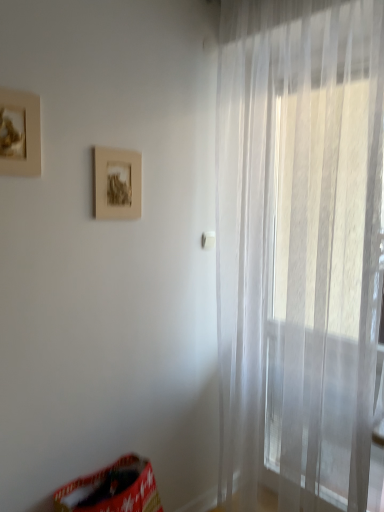
Question: Considering the relative positions of transparent fabric curtain at right and matte gold picture frame at upper left, the second picture frame when ordered from right to left, in the image provided, is transparent fabric curtain at right to the right of matte gold picture frame at upper left, the second picture frame when ordered from right to left, from the viewer's perspective?

Choices:
 (A) no
 (B) yes

Answer: (B)

Question: Does transparent fabric curtain at right come in front of matte gold picture frame at upper left, acting as the 1th picture frame starting from the left?

Choices:
 (A) yes
 (B) no

Answer: (A)

Question: Is transparent fabric curtain at right positioned far away from matte gold picture frame at upper left, which is the 2th picture frame from back to front?

Choices:
 (A) no
 (B) yes

Answer: (B)

Question: Is transparent fabric curtain at right bigger than matte gold picture frame at upper left, which is the 2th picture frame from back to front?

Choices:
 (A) yes
 (B) no

Answer: (A)

Question: Is transparent fabric curtain at right oriented towards matte gold picture frame at upper left, acting as the 1th picture frame starting from the left?

Choices:
 (A) no
 (B) yes

Answer: (B)

Question: From the image's perspective, is transparent fabric curtain at right above matte gold picture frame at upper left, which is the 2th picture frame from back to front?

Choices:
 (A) yes
 (B) no

Answer: (B)

Question: From the image's perspective, does matte brown picture frame at center, which is the first picture frame from back to front, appear lower than red fabric bean bag chair at lower left?

Choices:
 (A) yes
 (B) no

Answer: (B)

Question: Is matte brown picture frame at center, which is the first picture frame from back to front, directly adjacent to red fabric bean bag chair at lower left?

Choices:
 (A) yes
 (B) no

Answer: (B)

Question: Does matte brown picture frame at center, the 1th picture frame from the right, come in front of red fabric bean bag chair at lower left?

Choices:
 (A) no
 (B) yes

Answer: (A)

Question: Does matte brown picture frame at center, which is the second picture frame from left to right, appear on the right side of red fabric bean bag chair at lower left?

Choices:
 (A) no
 (B) yes

Answer: (A)

Question: Considering the relative sizes of matte brown picture frame at center, which is the second picture frame from left to right, and red fabric bean bag chair at lower left in the image provided, is matte brown picture frame at center, which is the second picture frame from left to right, wider than red fabric bean bag chair at lower left?

Choices:
 (A) no
 (B) yes

Answer: (A)

Question: Are matte brown picture frame at center, the 1th picture frame from the right, and red fabric bean bag chair at lower left far apart?

Choices:
 (A) yes
 (B) no

Answer: (A)

Question: From a real-world perspective, is red fabric bean bag chair at lower left beneath matte gold picture frame at upper left, which ranks as the first picture frame in front-to-back order?

Choices:
 (A) yes
 (B) no

Answer: (A)